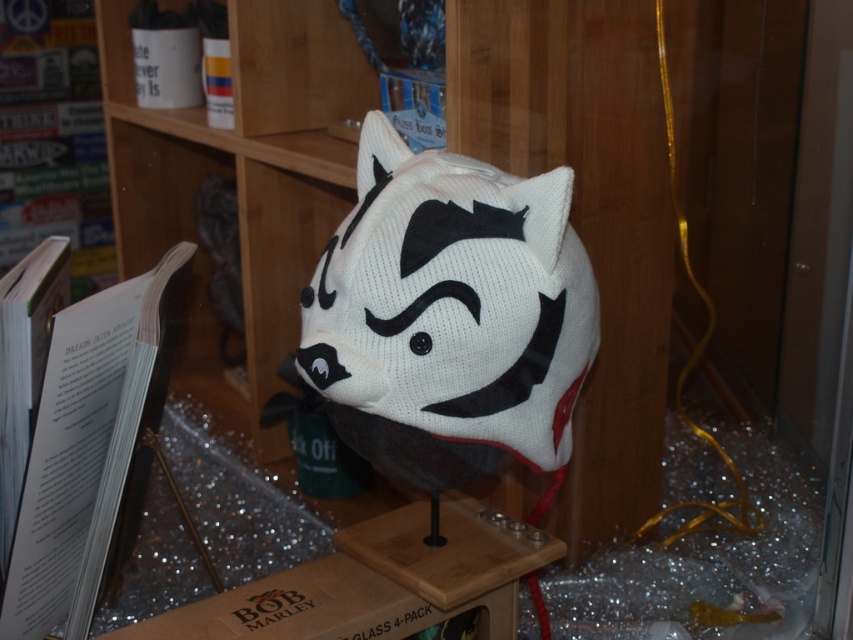
Question: Which point appears closest to the camera in this image?

Choices:
 (A) (590, 420)
 (B) (535, 438)

Answer: (B)

Question: Is wooden bookshelf at center in front of white knitted hat at center?

Choices:
 (A) no
 (B) yes

Answer: (A)

Question: Can you confirm if wooden bookshelf at center is smaller than white knitted hat at center?

Choices:
 (A) yes
 (B) no

Answer: (B)

Question: Which point is farther to the camera?

Choices:
 (A) white knitted hat at center
 (B) wooden bookshelf at center

Answer: (B)

Question: Can you confirm if wooden bookshelf at center is wider than white knitted hat at center?

Choices:
 (A) no
 (B) yes

Answer: (B)